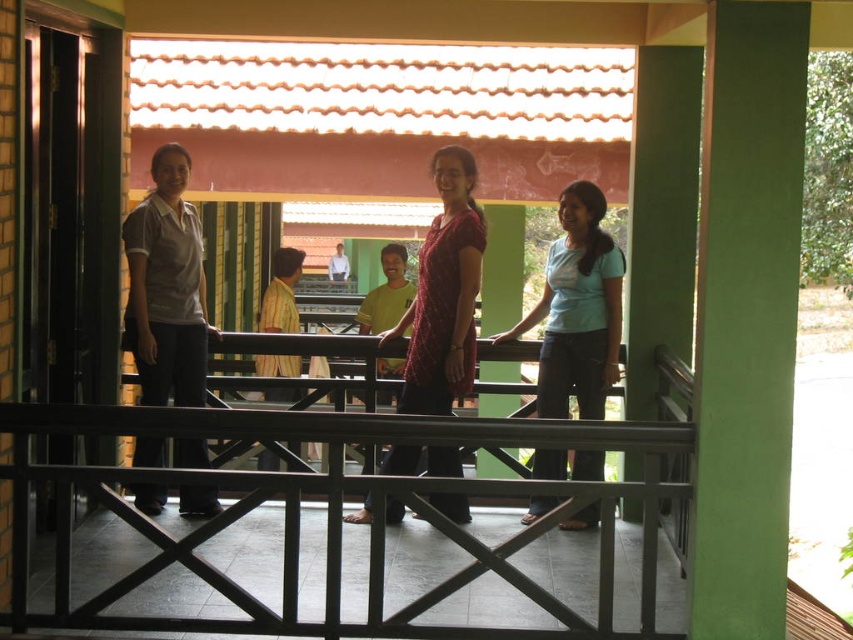
In the scene shown: You are a photographer trying to capture a group photo of the yellow fabric shirt at center and the light yellow shirt at center. Since you want to ensure both are in focus, you need to know which one is taller. Can you determine which is taller?

The yellow fabric shirt at center has a greater height compared to the light yellow shirt at center, so the yellow fabric shirt at center is taller.